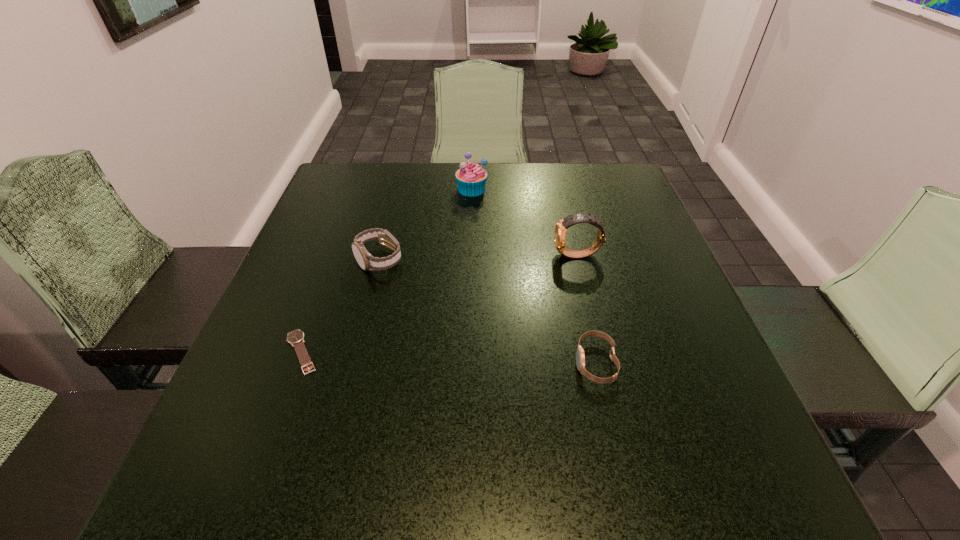
Image resolution: width=960 pixels, height=540 pixels. What are the coordinates of `vacant area situated on the face of the tallest watch` in the screenshot? It's located at (492, 255).

Locate an element on the screen. free location located 0.160m on the left of the muffin is located at coordinates pyautogui.click(x=397, y=189).

The width and height of the screenshot is (960, 540). What are the coordinates of `vacant space located 0.150m on the face of the third shortest watch` in the screenshot? It's located at (361, 330).

The height and width of the screenshot is (540, 960). I want to click on free space located on the face of the second shortest object, so click(430, 363).

Locate an element on the screen. vacant space located on the face of the second shortest object is located at coordinates (458, 363).

Where is `vacant space positioned on the face of the second shortest object`? Image resolution: width=960 pixels, height=540 pixels. vacant space positioned on the face of the second shortest object is located at coordinates (542, 363).

Find the location of a particular element. This screenshot has width=960, height=540. vacant space located on the right of the leftmost object is located at coordinates (503, 352).

This screenshot has height=540, width=960. In order to click on object present at the far edge in this screenshot , I will do `click(471, 177)`.

You are a GUI agent. You are given a task and a screenshot of the screen. Output one action in this format:
    pyautogui.click(x=<x>, y=<y>)
    Task: Click on the object that is at the right edge
    The height and width of the screenshot is (540, 960).
    Given the screenshot: What is the action you would take?
    point(561,227)

In the image, there is a desktop. Identify the location of vacant space at the far edge. The width and height of the screenshot is (960, 540). (435, 197).